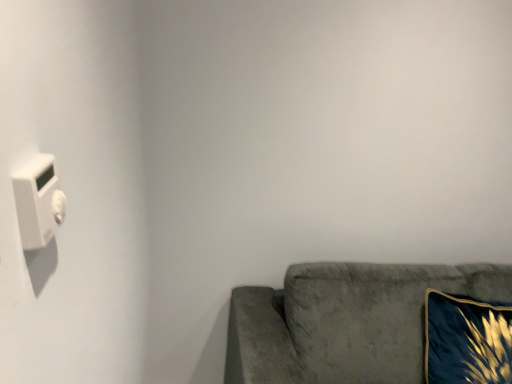
Question: From their relative heights in the image, would you say velvet gray couch at lower right is taller or shorter than velvet blue pillow at lower right?

Choices:
 (A) short
 (B) tall

Answer: (B)

Question: From a real-world perspective, is velvet gray couch at lower right positioned above or below velvet blue pillow at lower right?

Choices:
 (A) below
 (B) above

Answer: (A)

Question: Estimate the real-world distances between objects in this image. Which object is farther from the velvet blue pillow at lower right?

Choices:
 (A) velvet gray couch at lower right
 (B) white plastic light switch at left

Answer: (B)

Question: Estimate the real-world distances between objects in this image. Which object is farther from the white plastic light switch at left?

Choices:
 (A) velvet blue pillow at lower right
 (B) velvet gray couch at lower right

Answer: (A)